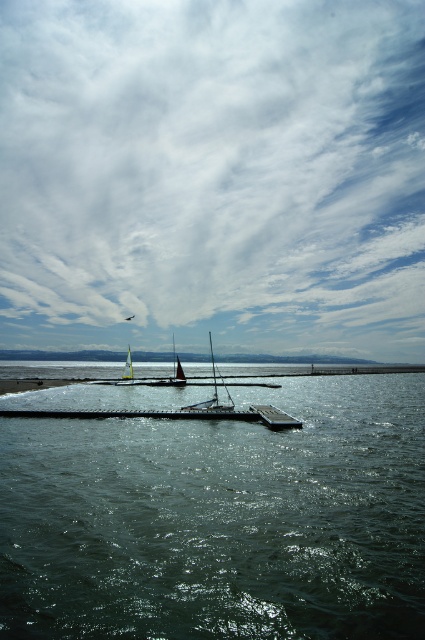
In the scene shown: Is dark green water at center below white glossy sailboat at center?

No, dark green water at center is not below white glossy sailboat at center.

I want to click on dark green water at center, so click(221, 520).

Does metallic gray dock at center have a larger size compared to white glossy sailboat at center?

No, metallic gray dock at center is not bigger than white glossy sailboat at center.

Who is lower down, metallic gray dock at center or white glossy sailboat at center?

white glossy sailboat at center is lower down.

Where is `metallic gray dock at center`? The height and width of the screenshot is (640, 425). metallic gray dock at center is located at coordinates (175, 413).

Is point (39, 410) less distant than point (178, 364)?

That is True.

Does metallic gray dock at center have a larger size compared to red sailboat at center?

No.

Between point (206, 412) and point (180, 381), which one is positioned behind?

Positioned behind is point (180, 381).

Locate an element on the screen. The image size is (425, 640). metallic gray dock at center is located at coordinates (175, 413).